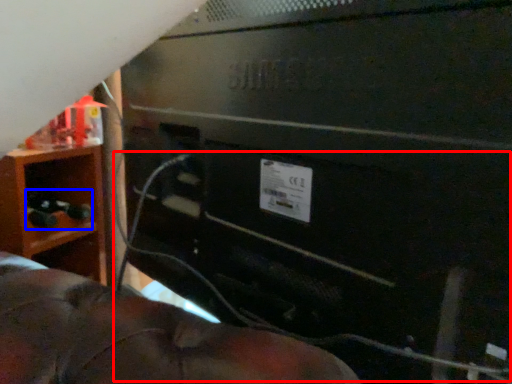
Question: Which object appears closest to the camera in this image, wire (highlighted by a red box) or toy (highlighted by a blue box)?

Choices:
 (A) wire
 (B) toy

Answer: (A)